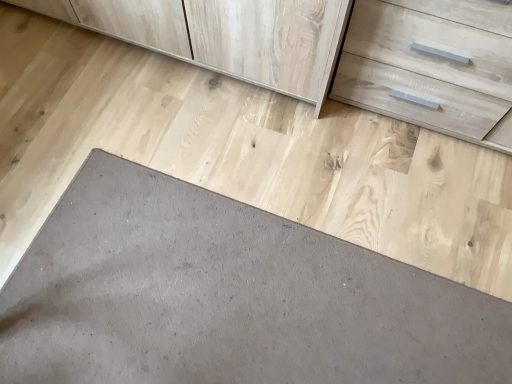
What are the coordinates of `light wood drawer at upper right` in the screenshot? It's located at (424, 69).

What is the approximate width of light wood drawer at upper right?

It is 17.50 inches.

What do you see at coordinates (424, 69) in the screenshot? The width and height of the screenshot is (512, 384). I see `light wood drawer at upper right` at bounding box center [424, 69].

Image resolution: width=512 pixels, height=384 pixels. What do you see at coordinates (227, 297) in the screenshot?
I see `gray matte slate at lower left` at bounding box center [227, 297].

Identify the location of gray matte slate at lower left. The height and width of the screenshot is (384, 512). [x=227, y=297].

Where is `light wood drawer at upper right`? The height and width of the screenshot is (384, 512). light wood drawer at upper right is located at coordinates (424, 69).

Is gray matte slate at lower left at the left side of light wood drawer at upper right?

Indeed, gray matte slate at lower left is positioned on the left side of light wood drawer at upper right.

Does gray matte slate at lower left come in front of light wood drawer at upper right?

No, gray matte slate at lower left is further to the viewer.

Which is in front, point (459, 369) or point (414, 39)?

Positioned in front is point (459, 369).

From the image's perspective, which is below, gray matte slate at lower left or light wood drawer at upper right?

gray matte slate at lower left.

From a real-world perspective, between gray matte slate at lower left and light wood drawer at upper right, who is vertically higher?

In real-world perspective, light wood drawer at upper right is above.

Can you confirm if gray matte slate at lower left is wider than light wood drawer at upper right?

Indeed, gray matte slate at lower left has a greater width compared to light wood drawer at upper right.

Considering the relative sizes of gray matte slate at lower left and light wood drawer at upper right in the image provided, is gray matte slate at lower left taller than light wood drawer at upper right?

Incorrect, the height of gray matte slate at lower left is not larger of that of light wood drawer at upper right.

From the picture: Who is smaller, gray matte slate at lower left or light wood drawer at upper right?

gray matte slate at lower left is smaller.

Is gray matte slate at lower left situated inside light wood drawer at upper right or outside?

gray matte slate at lower left lies outside light wood drawer at upper right.

Would you consider gray matte slate at lower left to be distant from light wood drawer at upper right?

They are positioned close to each other.

Based on the photo, is gray matte slate at lower left oriented away from light wood drawer at upper right?

That's not correct — gray matte slate at lower left is not looking away from light wood drawer at upper right.

In the scene shown: Measure the distance from gray matte slate at lower left to light wood drawer at upper right.

A distance of 25.72 inches exists between gray matte slate at lower left and light wood drawer at upper right.

At what (x,y) coordinates should I click in order to perform the action: click on drawer located on the right of gray matte slate at lower left. Please return your answer as a coordinate pair (x, y). The height and width of the screenshot is (384, 512). Looking at the image, I should click on (424, 69).

Based on the photo, can you confirm if light wood drawer at upper right is positioned to the right of gray matte slate at lower left?

Yes.

Does light wood drawer at upper right lie in front of gray matte slate at lower left?

Yes, the depth of light wood drawer at upper right is less than that of gray matte slate at lower left.

Which is in front, point (399, 23) or point (267, 290)?

Point (399, 23)

From the image's perspective, is light wood drawer at upper right located above or below gray matte slate at lower left?

light wood drawer at upper right is situated higher than gray matte slate at lower left in the image.

From a real-world perspective, which object rests below the other?

gray matte slate at lower left.

Between light wood drawer at upper right and gray matte slate at lower left, which one has smaller width?

With smaller width is light wood drawer at upper right.

Is light wood drawer at upper right taller than gray matte slate at lower left?

Yes, light wood drawer at upper right is taller than gray matte slate at lower left.

Considering the sizes of objects light wood drawer at upper right and gray matte slate at lower left in the image provided, who is bigger, light wood drawer at upper right or gray matte slate at lower left?

Bigger between the two is light wood drawer at upper right.

Is light wood drawer at upper right not within gray matte slate at lower left?

Yes.

Is light wood drawer at upper right not near gray matte slate at lower left?

light wood drawer at upper right is near gray matte slate at lower left, not far away.

Is light wood drawer at upper right oriented away from gray matte slate at lower left?

That's not correct — light wood drawer at upper right is not looking away from gray matte slate at lower left.

Locate an element on the screen. The height and width of the screenshot is (384, 512). drawer above the gray matte slate at lower left (from the image's perspective) is located at coordinates pos(424,69).

At what (x,y) coordinates should I click in order to perform the action: click on slate below the light wood drawer at upper right (from a real-world perspective). Please return your answer as a coordinate pair (x, y). The image size is (512, 384). Looking at the image, I should click on click(x=227, y=297).

The height and width of the screenshot is (384, 512). Identify the location of drawer above the gray matte slate at lower left (from a real-world perspective). pyautogui.click(x=424, y=69).